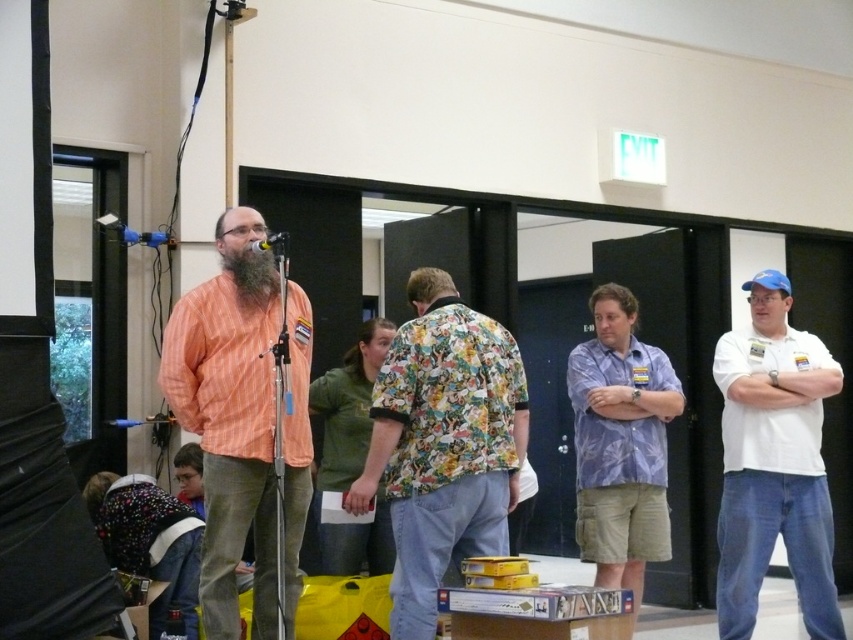
Can you confirm if orange striped shirt at center is thinner than white cotton shirt at right?

Yes, orange striped shirt at center is thinner than white cotton shirt at right.

Is point (253, 490) behind point (782, 326)?

No, it is in front of (782, 326).

Find the location of a particular element. orange striped shirt at center is located at coordinates (230, 416).

Can you confirm if orange striped shirt at center is positioned below matte black microphone at center?

Indeed, orange striped shirt at center is positioned under matte black microphone at center.

Is orange striped shirt at center closer to camera compared to matte black microphone at center?

Yes, orange striped shirt at center is in front of matte black microphone at center.

Locate an element on the screen. The image size is (853, 640). orange striped shirt at center is located at coordinates (230, 416).

Where is `orange striped shirt at center`? This screenshot has width=853, height=640. orange striped shirt at center is located at coordinates (230, 416).

Which is above, white cotton shirt at right or beardsoft hair at center?

Positioned higher is beardsoft hair at center.

Which is behind, point (738, 509) or point (231, 257)?

The point (738, 509) is behind.

Is point (730, 492) in front of point (250, 289)?

No, it is not.

The width and height of the screenshot is (853, 640). What are the coordinates of `white cotton shirt at right` in the screenshot? It's located at (775, 464).